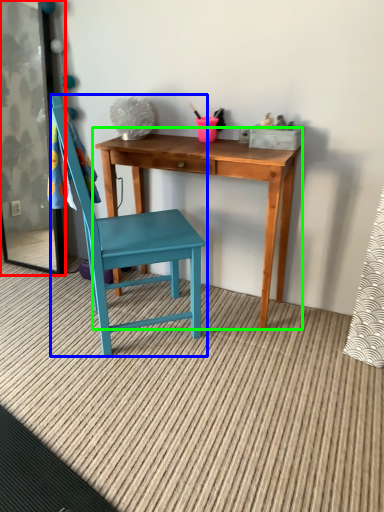
Question: Which object is positioned closest to screen door (highlighted by a red box)? Select from chair (highlighted by a blue box) and table (highlighted by a green box).

Choices:
 (A) chair
 (B) table

Answer: (A)